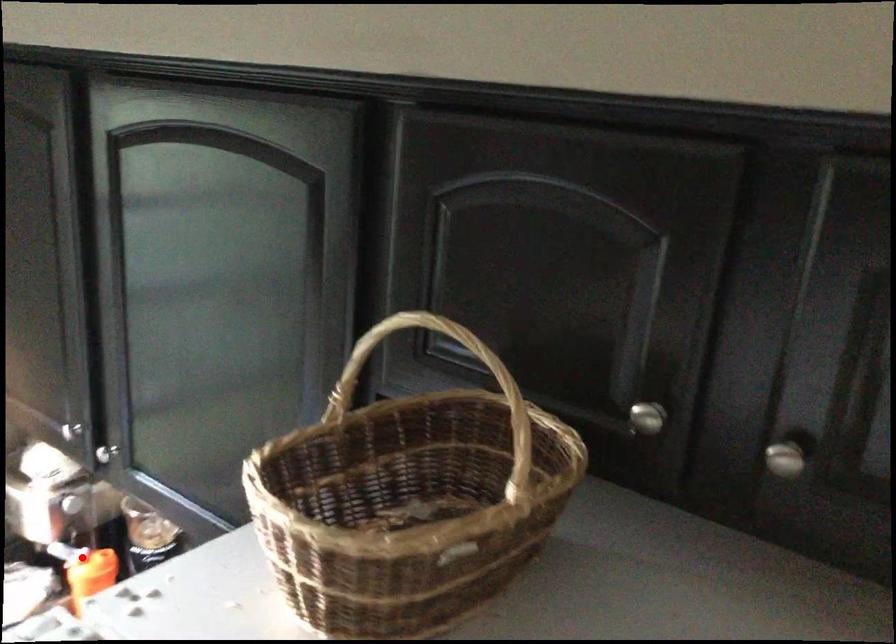
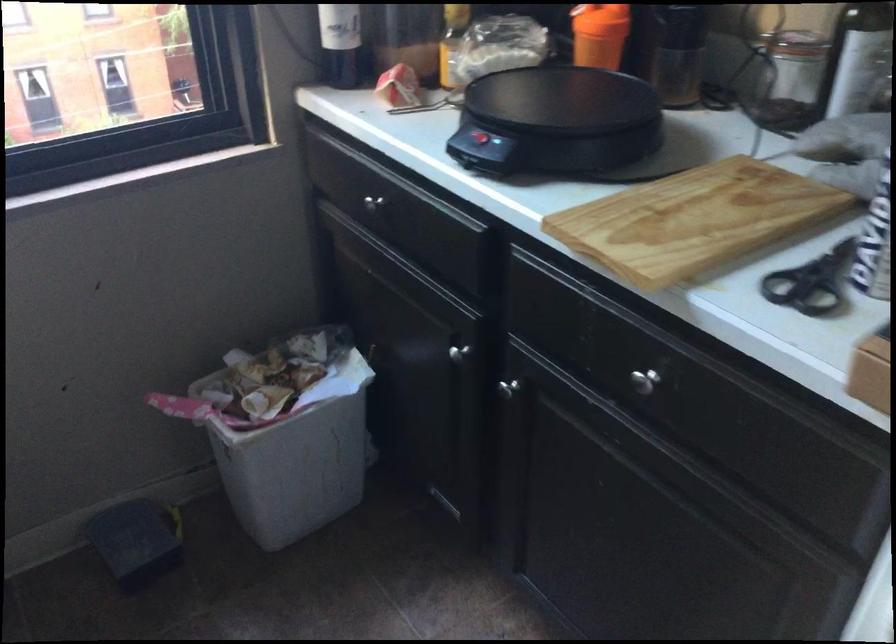
Question: I am providing you with two images of the same scene from different viewpoints. Image1 has a red point marked. In image2, the corresponding 3D location appears at what relative position? Reply with the corresponding letter.

Choices:
 (A) Closer
 (B) Farther

Answer: (A)